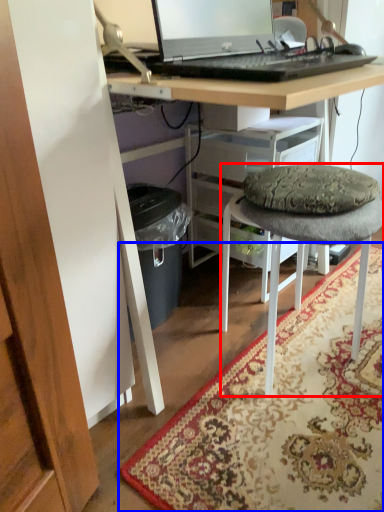
Question: Which of the following is the closest to the observer, stool (highlighted by a red box) or mat (highlighted by a blue box)?

Choices:
 (A) stool
 (B) mat

Answer: (B)